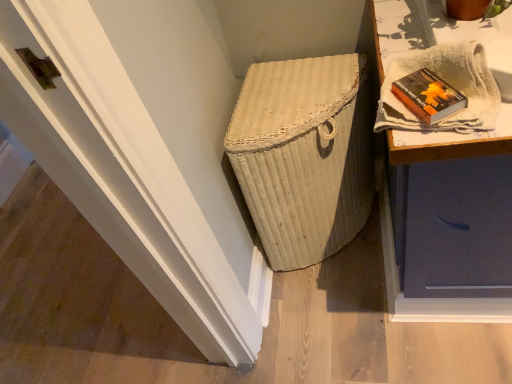
Question: Is hardcover book at upper right wider or thinner than white textured cloth at upper right?

Choices:
 (A) thin
 (B) wide

Answer: (A)

Question: Considering the positions of point (446, 100) and point (404, 54), is point (446, 100) closer or farther from the camera than point (404, 54)?

Choices:
 (A) closer
 (B) farther

Answer: (A)

Question: Which of these objects is positioned farthest from the white wicker basket at center?

Choices:
 (A) white textured cloth at upper right
 (B) hardcover book at upper right

Answer: (B)

Question: Estimate the real-world distances between objects in this image. Which object is farther from the hardcover book at upper right?

Choices:
 (A) white textured cloth at upper right
 (B) white wicker basket at center

Answer: (B)